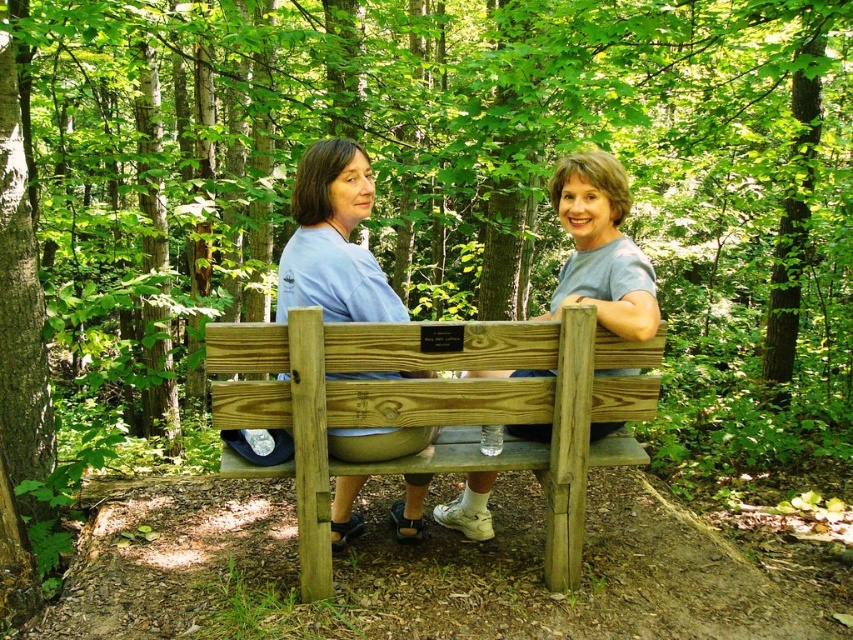
Question: Which object is closer to the camera taking this photo?

Choices:
 (A) matte blue shirt at center
 (B) wooden bench at center
 (C) gray matte wood bench at center

Answer: (B)

Question: Which point is closer to the camera taking this photo?

Choices:
 (A) (213, 362)
 (B) (305, 173)

Answer: (A)

Question: Is the position of wooden bench at center more distant than that of matte blue shirt at center?

Choices:
 (A) yes
 (B) no

Answer: (B)

Question: Based on their relative distances, which object is farther from the matte blue shirt at center?

Choices:
 (A) gray matte wood bench at center
 (B) wooden bench at center

Answer: (A)

Question: Can you confirm if wooden bench at center is positioned below matte blue shirt at center?

Choices:
 (A) yes
 (B) no

Answer: (A)

Question: Does wooden bench at center appear over gray matte wood bench at center?

Choices:
 (A) yes
 (B) no

Answer: (B)